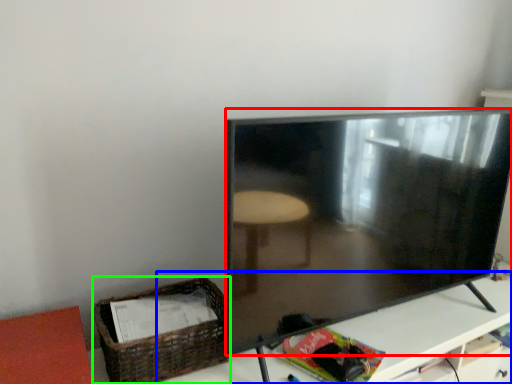
Question: Considering the real-world distances, which object is closest to television (highlighted by a red box)? table (highlighted by a blue box) or basket (highlighted by a green box).

Choices:
 (A) table
 (B) basket

Answer: (A)